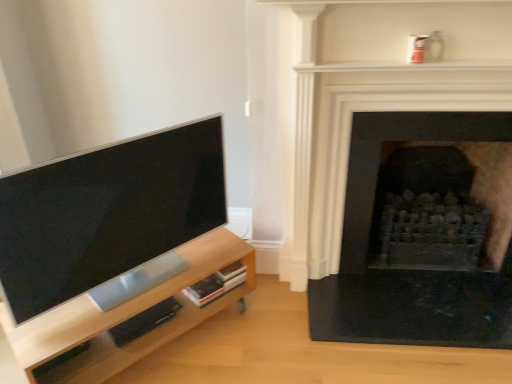
The image size is (512, 384). In order to click on free space to the right of light wood entertainment center at left in this screenshot , I will do tap(262, 345).